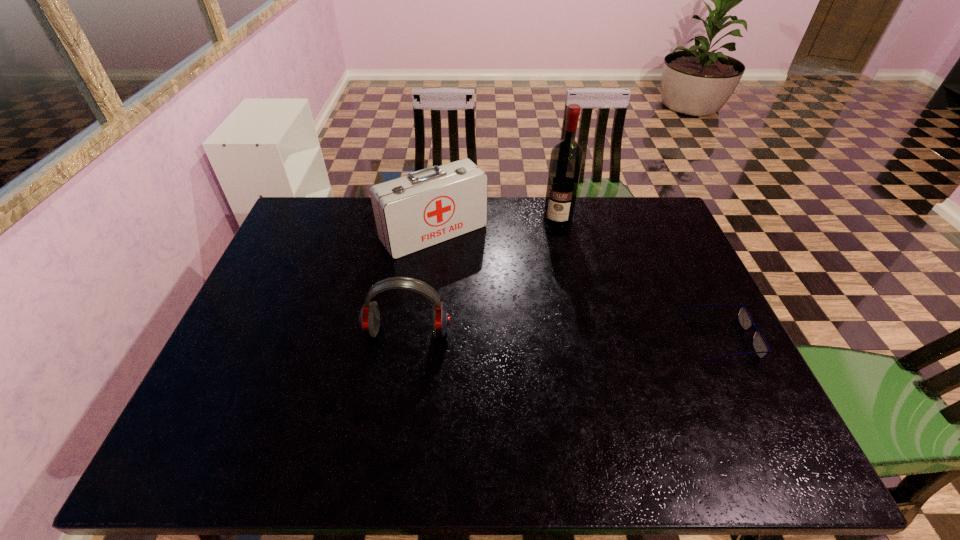
Locate an element on the screen. The width and height of the screenshot is (960, 540). earphone is located at coordinates (369, 319).

What are the coordinates of `the rightmost object` in the screenshot? It's located at (759, 344).

I want to click on the shortest object, so click(x=759, y=344).

Where is `the tallest object`? The image size is (960, 540). the tallest object is located at coordinates (566, 158).

Where is `alcohol`? This screenshot has width=960, height=540. alcohol is located at coordinates (566, 158).

You are a GUI agent. You are given a task and a screenshot of the screen. Output one action in this format:
    pyautogui.click(x=<x>, y=<y>)
    Task: Click on the first-aid kit
    
    Given the screenshot: What is the action you would take?
    pyautogui.click(x=429, y=206)

Where is `free space located on the ear cups of the second shortest object`? This screenshot has height=540, width=960. free space located on the ear cups of the second shortest object is located at coordinates (400, 372).

Image resolution: width=960 pixels, height=540 pixels. In order to click on free space located 0.150m on the front and back of the tallest object in this screenshot , I will do `click(549, 259)`.

Locate an element on the screen. vacant space situated 0.380m on the front and back of the tallest object is located at coordinates (537, 313).

Identify the location of free space located 0.330m on the front and back of the tallest object. This screenshot has width=960, height=540. point(540,300).